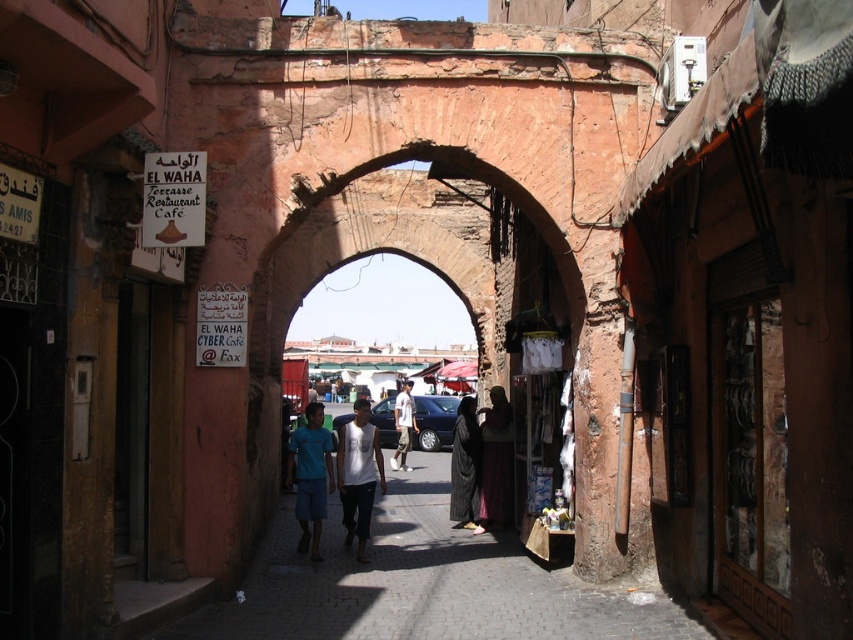
You are a tourist standing at the entrance of the EL WAHA Terrace Restaurant. You see the rustic stone archway at center and the blue cotton shirt at center in the scene. Which object is farther away from you?

The rustic stone archway at center is farther away from you than the blue cotton shirt at center because the distance between them is 37.06 feet.

You are a tourist standing at the entrance of the EL WAHA Terrace Restaurant Cafe and want to take a photo of the rustic stone archway at center and the black fabric person at center. Which object should you position to your right side to ensure both are in the frame?

The rustic stone archway at center is to the left of the black fabric person at center, so to have both in the frame, position the black fabric person at center to your right side so the rustic stone archway at center will be on the left and the black fabric person at center on the right in the photo.

Looking at this image, you are a traveler standing in front of the EL WAHA Terrace Restaurant Cafe and want to take a photo of the white cotton shirt at center and the black fabric person at center. In which direction should you move to ensure both are in the frame?

Move to the left so that the white cotton shirt at center is to the left of the black fabric person at center, keeping both in the frame.